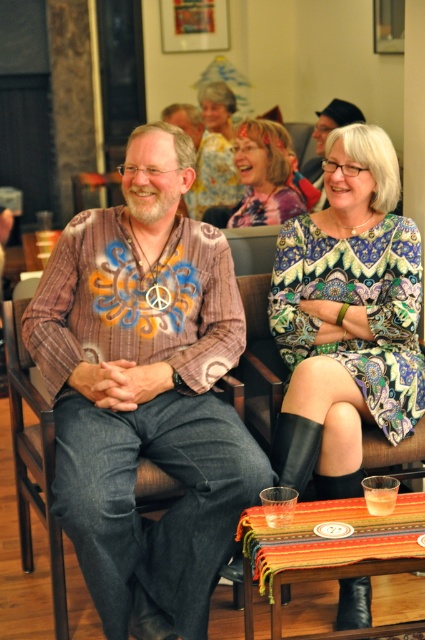
Question: Estimate the real-world distances between objects in this image. Which object is farther from the printed fabric dress at center?

Choices:
 (A) multicolored printed dress at center
 (B) printed cotton shirt at center

Answer: (A)

Question: Is multicolored printed dress at center positioned before matte yellow blouse at upper center?

Choices:
 (A) no
 (B) yes

Answer: (B)

Question: Which point is farther to the camera?

Choices:
 (A) printed cotton shirt at center
 (B) printed fabric dress at center

Answer: (B)

Question: Does printed cotton shirt at center lie behind multicolored printed dress at center?

Choices:
 (A) yes
 (B) no

Answer: (B)

Question: Which point is farther to the camera?

Choices:
 (A) (266, 156)
 (B) (235, 102)

Answer: (B)

Question: Is printed fabric dress at center thinner than multicolored printed dress at center?

Choices:
 (A) yes
 (B) no

Answer: (B)